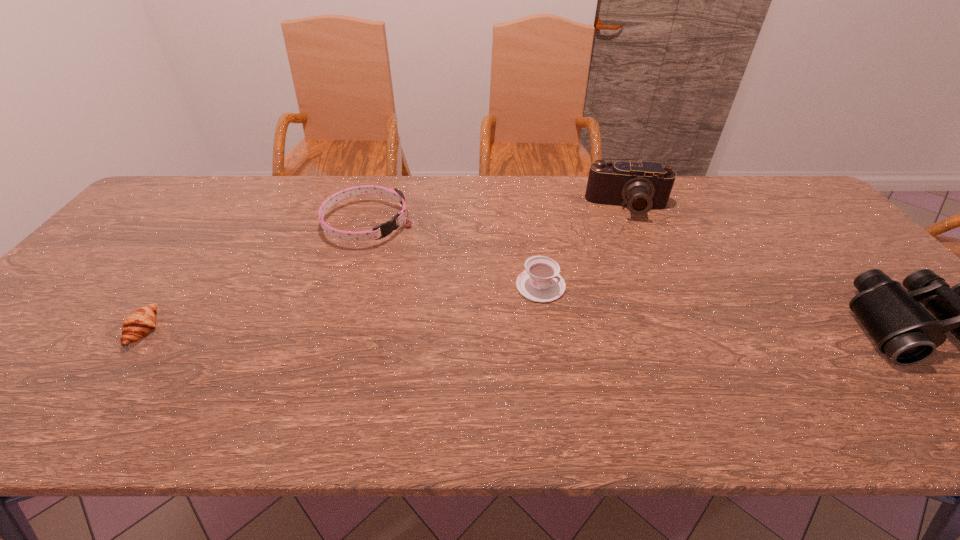
Locate an element on the screen. The image size is (960, 540). vacant space located 0.210m with the buckle on the second object from left to right is located at coordinates (453, 272).

Identify the location of vacant space located with the buckle on the second object from left to right. (500, 299).

Find the location of a particular element. The image size is (960, 540). free space located on the handle side of the teacup is located at coordinates (641, 337).

Where is `vacant space situated on the handle side of the teacup`? The image size is (960, 540). vacant space situated on the handle side of the teacup is located at coordinates (590, 311).

Locate an element on the screen. This screenshot has height=540, width=960. free space located on the handle side of the teacup is located at coordinates (654, 343).

Find the location of `camera at the far edge`. camera at the far edge is located at coordinates (640, 186).

I want to click on dog collar present at the far edge, so click(x=387, y=228).

I want to click on object located at the near edge, so click(x=137, y=325).

The height and width of the screenshot is (540, 960). I want to click on vacant space at the far edge of the desktop, so click(x=425, y=188).

Where is `vacant region at the near edge`? vacant region at the near edge is located at coordinates (630, 364).